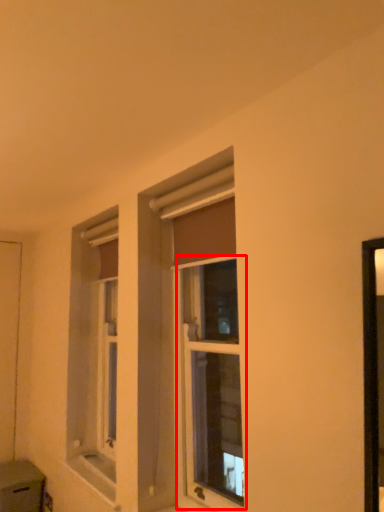
Question: In this image, where is window (annotated by the red box) located relative to screen door?

Choices:
 (A) left
 (B) right

Answer: (B)